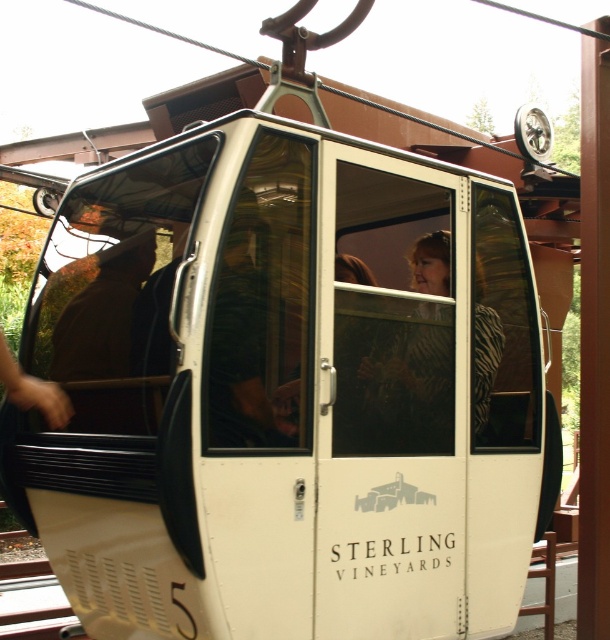
You are a tour guide explaining the Sterling Vineyards cable car to visitors. You need to mention both the transparent glass window at center and the zebra print blouse at center in your explanation. How do their sizes compare?

The transparent glass window at center is bigger than the zebra print blouse at center.